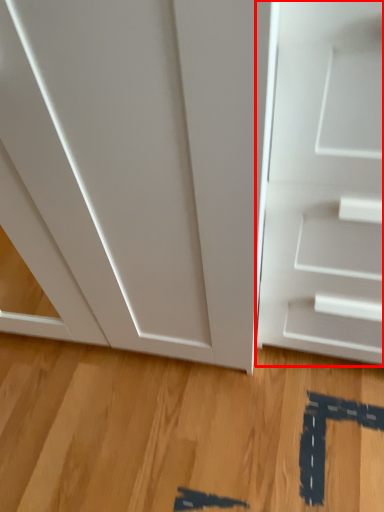
Question: From the image's perspective, considering the relative positions of door (annotated by the red box) and hardwood in the image provided, where is door (annotated by the red box) located with respect to the staircase?

Choices:
 (A) above
 (B) below

Answer: (A)